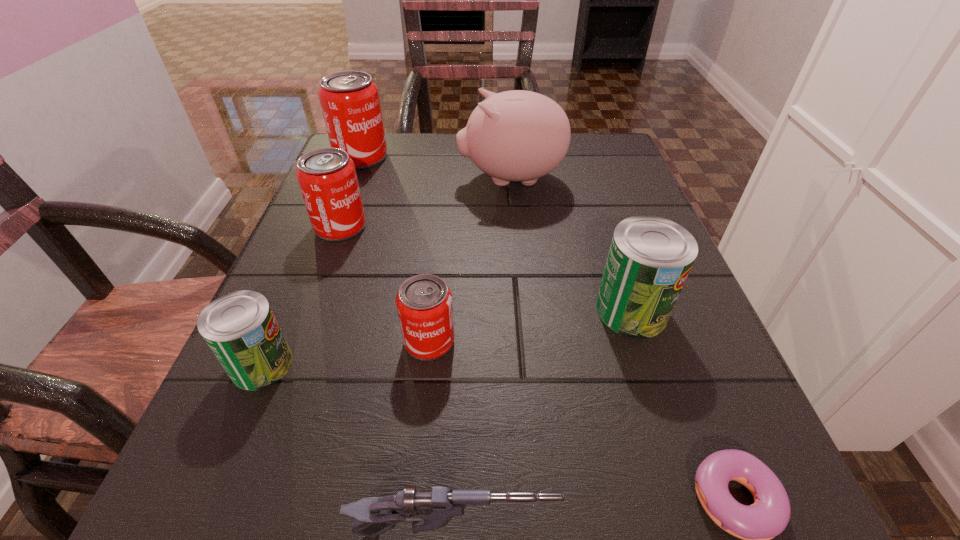
Identify the location of the nearer green can. This screenshot has height=540, width=960. (240, 328).

Identify the location of vacant region located at the snout of the piggy bank. This screenshot has height=540, width=960. (349, 179).

At what (x,y) coordinates should I click in order to perform the action: click on free point located at the snout of the piggy bank. Please return your answer as a coordinate pair (x, y). Image resolution: width=960 pixels, height=540 pixels. Looking at the image, I should click on (399, 179).

Locate an element on the screen. The height and width of the screenshot is (540, 960). vacant space located 0.110m at the snout of the piggy bank is located at coordinates (408, 179).

Locate an element on the screen. The width and height of the screenshot is (960, 540). vacant area situated 0.350m on the right of the farthest can is located at coordinates (535, 157).

Find the location of a particular element. The width and height of the screenshot is (960, 540). free space located 0.230m on the front of the fourth nearest can is located at coordinates (298, 341).

Locate an element on the screen. Image resolution: width=960 pixels, height=540 pixels. vacant area located on the back of the farther green can is located at coordinates (604, 226).

The image size is (960, 540). What are the coordinates of `vacant region located 0.220m on the left of the second can from right to left` in the screenshot? It's located at (256, 341).

Identify the location of blank space located on the back of the nearer green can. (319, 229).

This screenshot has height=540, width=960. In order to click on piggy bank located in the far edge section of the desktop in this screenshot , I will do `click(517, 135)`.